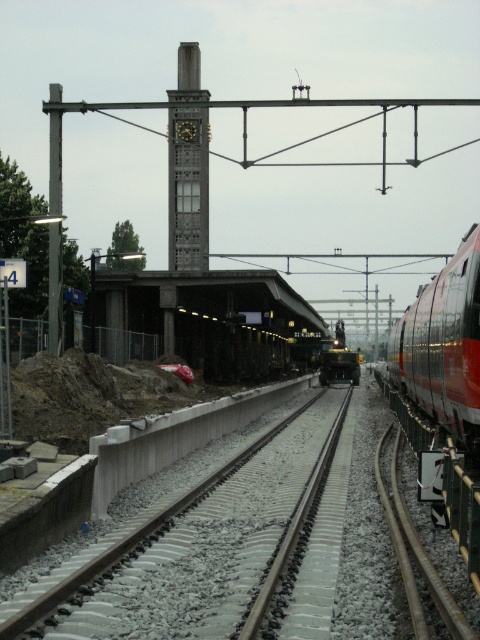
Question: Is gray concrete train track at center below red glossy train at right?

Choices:
 (A) no
 (B) yes

Answer: (B)

Question: Can you confirm if gray concrete train track at center is wider than shiny metallic train at center?

Choices:
 (A) yes
 (B) no

Answer: (A)

Question: Which object is the farthest from the red glossy train at right?

Choices:
 (A) concrete platform at center
 (B) shiny metallic train at center
 (C) gray concrete train track at center

Answer: (B)

Question: Which of these objects is positioned closest to the gray concrete train track at center?

Choices:
 (A) red glossy train at right
 (B) shiny metallic train at center
 (C) concrete platform at center

Answer: (A)

Question: Among these points, which one is nearest to the camera?

Choices:
 (A) (121, 291)
 (B) (335, 368)
 (C) (465, 284)
 (D) (92, 636)

Answer: (D)

Question: Where is gray concrete train track at center located in relation to concrete platform at center in the image?

Choices:
 (A) left
 (B) right

Answer: (B)